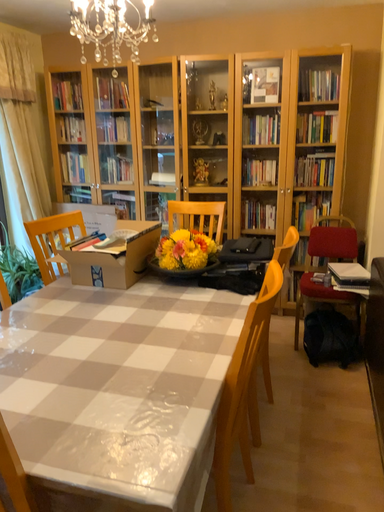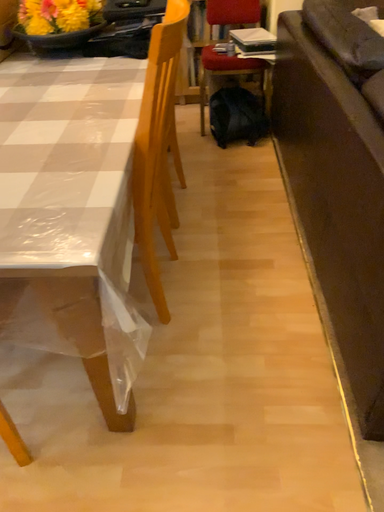
Question: Which way did the camera rotate in the video?

Choices:
 (A) rotated right
 (B) rotated left

Answer: (A)